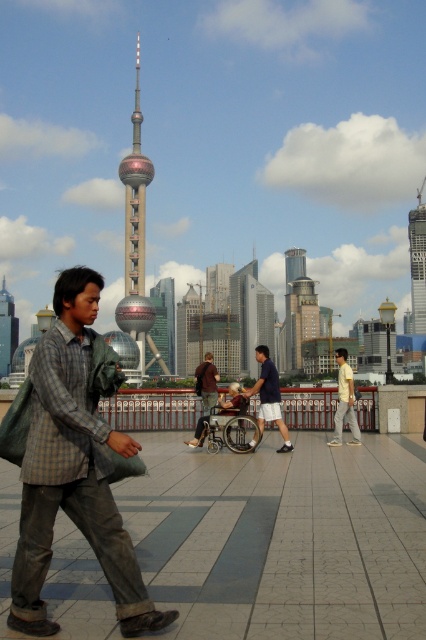
You are a photographer standing on the walkway and want to take a photo of the two people wearing the plaid fabric shirt at center and yellow cotton shirt at center. Which one should you adjust your camera angle to focus on first if you want to capture them from left to right in the frame?

You should focus on the plaid fabric shirt at center first because it is positioned to the left of the yellow cotton shirt at center, so when arranging from left to right, it comes first.

You are standing at the point marked by the coordinates point (x=268, y=396). Looking towards the Oriental Pearl Tower in the background, which direction should you walk to avoid the man in the plaid shirt on the left side?

The dark blue cotton shirt at center is represented by point (x=268, y=396). Since the man in the plaid shirt is on the left side, you should walk towards the right to avoid him while heading towards the Oriental Pearl Tower.